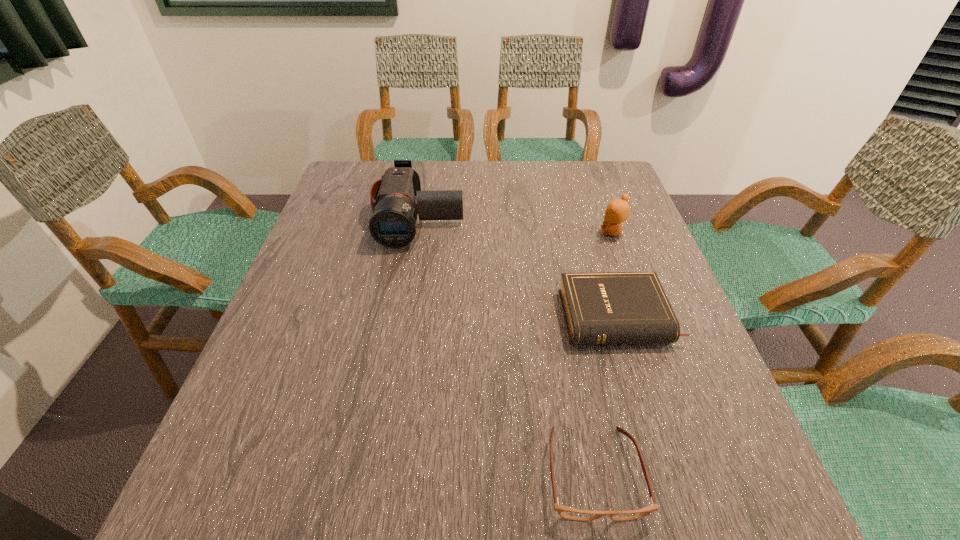
Locate an element on the screen. This screenshot has width=960, height=540. vacant area between the leftmost object and the shortest object is located at coordinates (506, 345).

In order to click on the third closest object relative to the leftmost object in this screenshot , I will do `click(566, 512)`.

Where is `object identified as the closest to the camcorder`? Image resolution: width=960 pixels, height=540 pixels. object identified as the closest to the camcorder is located at coordinates (613, 307).

What are the coordinates of `vacant space that satisfies the following two spatial constraints: 1. on the face of the teddy bear; 2. on the front side of the second nearest object` in the screenshot? It's located at (643, 317).

The width and height of the screenshot is (960, 540). Identify the location of vacant space that satisfies the following two spatial constraints: 1. on the face of the teddy bear; 2. on the front-facing side of the nearest object. (699, 472).

The width and height of the screenshot is (960, 540). I want to click on free space that satisfies the following two spatial constraints: 1. on the lens of the Bible; 2. on the right side of the leftmost object, so click(401, 317).